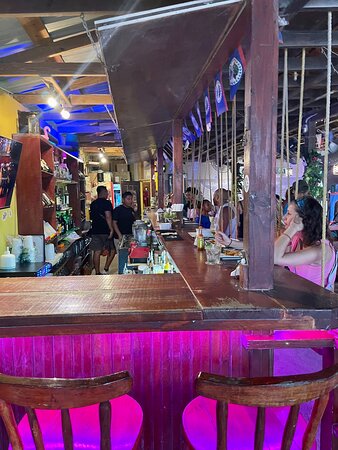
This screenshot has height=450, width=338. In order to click on wooden chairs in this screenshot , I will do `click(259, 396)`, `click(75, 393)`.